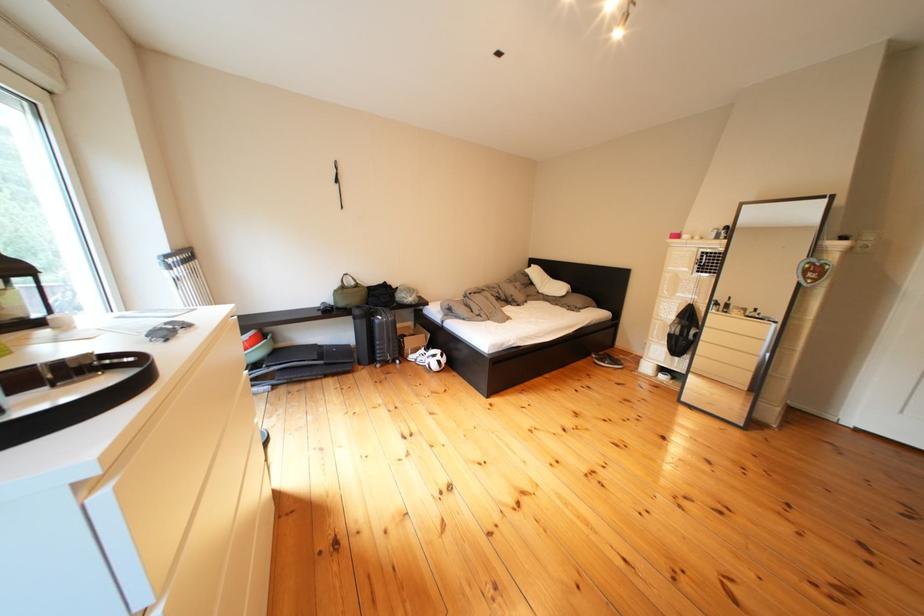
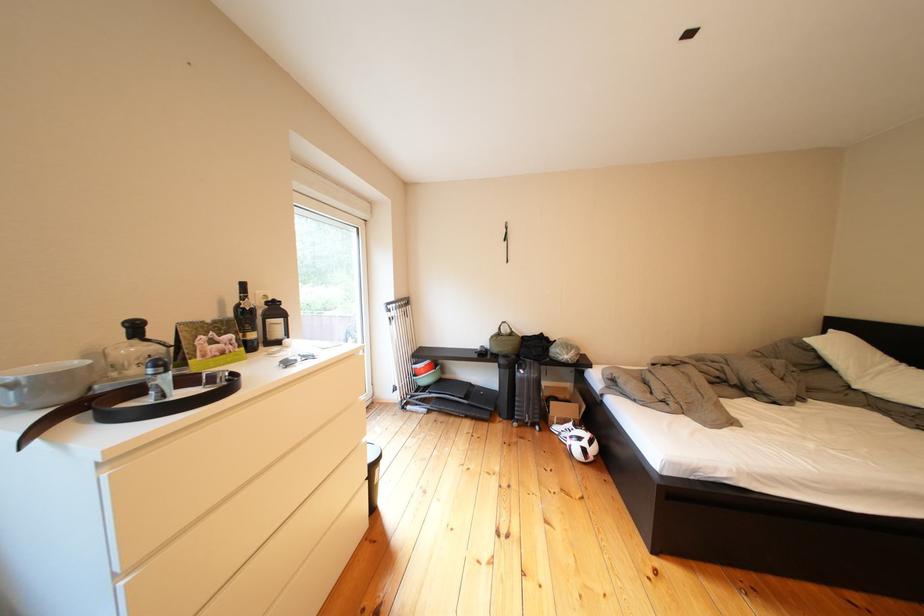
Question: The camera is either moving clockwise (left) or counter-clockwise (right) around the object. The first image is from the beginning of the video and the second image is from the end. Is the camera moving left or right when shooting the video?

Choices:
 (A) Left
 (B) Right

Answer: (B)